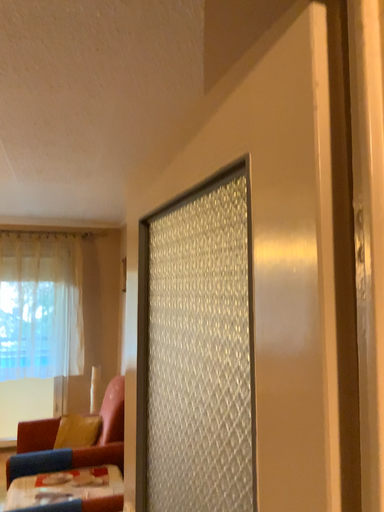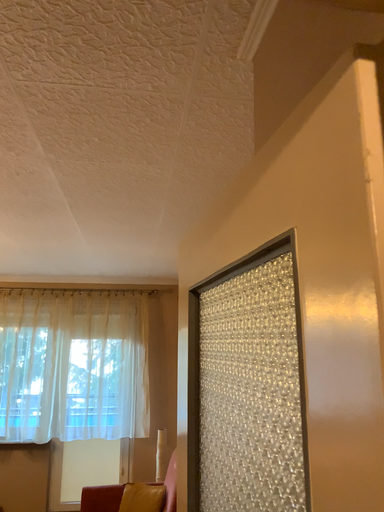
Question: Which way did the camera rotate in the video?

Choices:
 (A) rotated left
 (B) rotated right

Answer: (A)